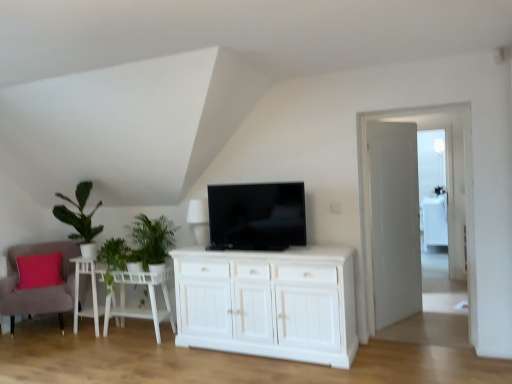
Question: Looking at their shapes, would you say green leafy plant at left, the first plant from the left, is wider or thinner than white wooden door at right?

Choices:
 (A) wide
 (B) thin

Answer: (A)

Question: Considering the positions of green leafy plant at left, the first plant from the left, and white wooden door at right in the image, is green leafy plant at left, the first plant from the left, taller or shorter than white wooden door at right?

Choices:
 (A) tall
 (B) short

Answer: (B)

Question: Which is farther from the velvet pink armchair at lower left?

Choices:
 (A) white wood side table at lower left
 (B) green leafy plant at left, positioned as the 2th plant in right-to-left order
 (C) transparent glass door at right, the first glass door viewed from the front
 (D) white matte table at lower left
 (E) transparent glass door at right, the 1th glass door in the right-to-left sequence

Answer: (E)

Question: Considering the real-world distances, which object is closest to the black glossy tv at center?

Choices:
 (A) green leafy plant at left
 (B) white wooden door at right
 (C) velvet pink armchair at lower left
 (D) transparent glass door at right, which ranks as the second glass door in left-to-right order
 (E) transparent glass door at right, the first glass door viewed from the front

Answer: (E)